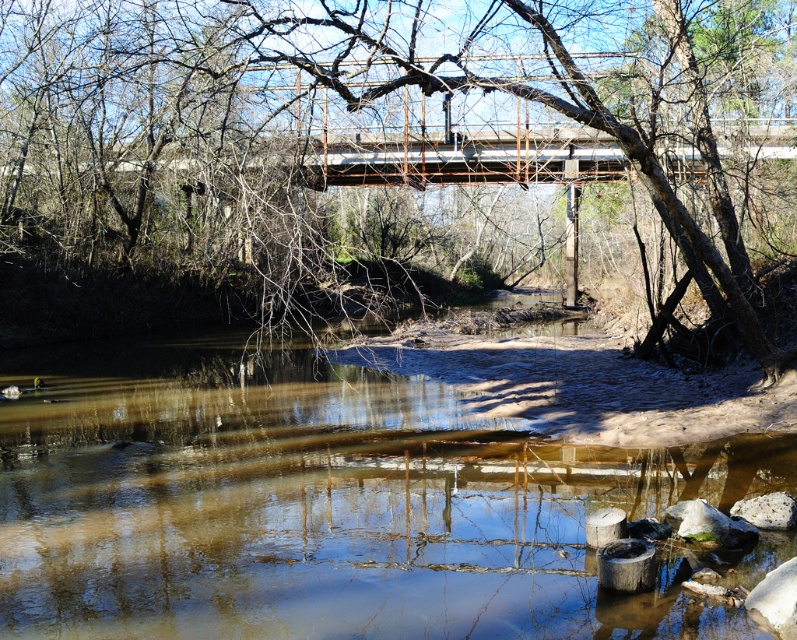
You are standing at the center of the metal bridge and want to locate the brown rough tree at upper center. According to the scene description, where should you look relative to your position?

The brown rough tree at upper center is located at point coordinates approximately 0.245 on the x axis and 0.486 on the y axis. Since you are at the center of the metal bridge, you should look towards the upper center direction to find the tree.

You are an environmental scientist assessing the river ecosystem. You observe the brown rough tree at upper center and the brown sedimentary river at center. Which object is closer to the observer in this scene?

The brown rough tree at upper center is closer to the observer because the brown sedimentary river at center is described as being behind it.

You are standing at the camera position and want to reach the point marked as point (709, 147). Can you walk directly to it from your current position?

The point (709, 147) is 14.72 meters away from the camera, so yes, you can walk directly to it as long as there are no obstacles in between.